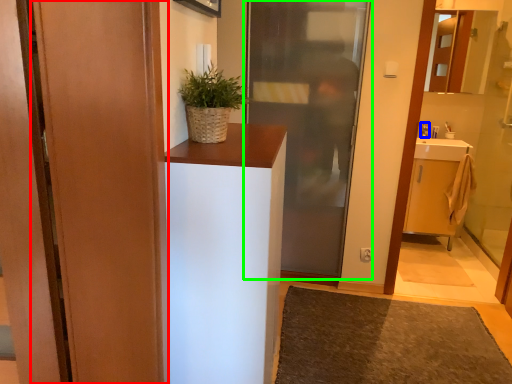
Question: Which object is the closest to the door (highlighted by a red box)? Choose among these: toiletry (highlighted by a blue box) or door (highlighted by a green box).

Choices:
 (A) toiletry
 (B) door

Answer: (B)